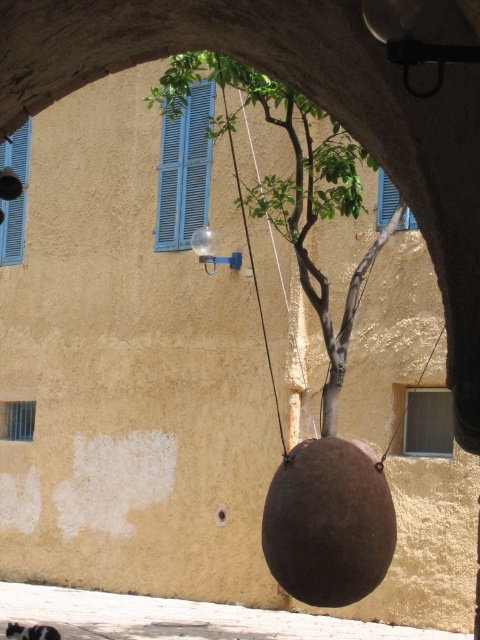
You are an interior designer planning to install a new light fixture between the brown matte tree at center and the blue painted wood shutter at upper left. Based on their positions, where should the light fixture be placed?

The brown matte tree at center is above the blue painted wood shutter at upper left, so the light fixture should be placed between them, below the brown matte tree at center and above the blue painted wood shutter at upper left.

You are an interior designer assessing the space through the arched opening. You notice the blue wooden shutter at left and the blue wooden shutter at upper center. Which of these two shutters could potentially accommodate a wider decorative item, like a large wreath, without blocking the window?

The blue wooden shutter at left is wider than the blue wooden shutter at upper center, so it could accommodate a wider decorative item like a large wreath without blocking the window.